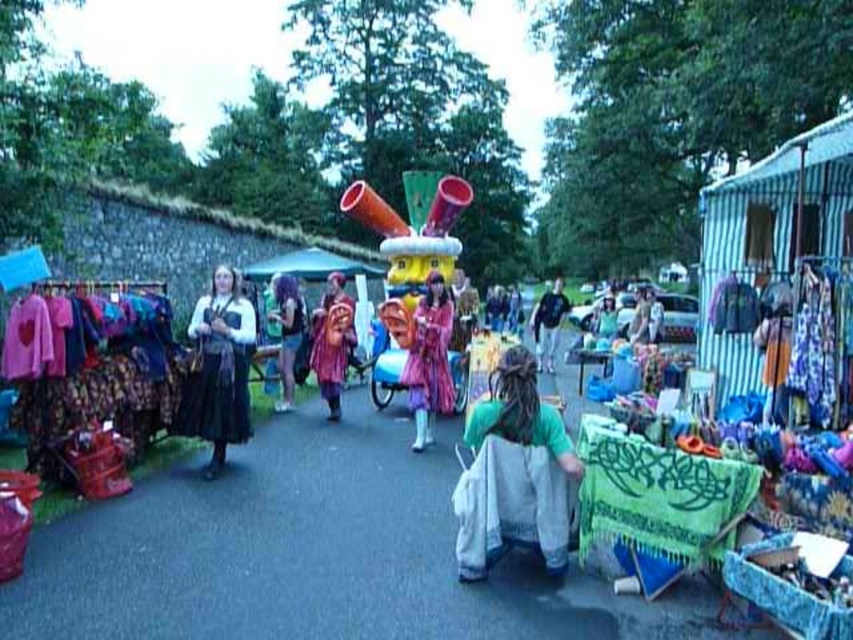
You are a vendor at the market and want to display the purple fabric dress at center and the blue fabric dress at center on a single rack. Which dress should you place on the left side of the rack to ensure they both fit without overlapping?

The purple fabric dress at center has a smaller width than the blue fabric dress at center, so placing the purple fabric dress at center on the left side would allow both dresses to fit on the rack without overlapping.